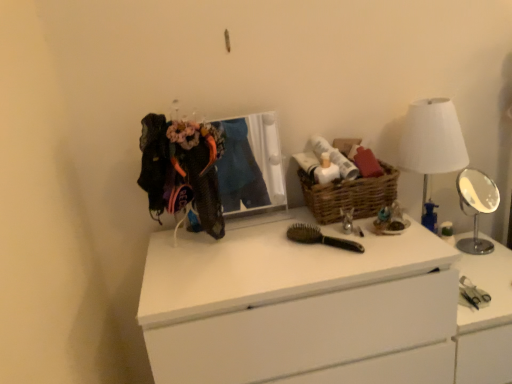
Locate an element on the screen. The height and width of the screenshot is (384, 512). free space between black wooden hairbrush at center and knitted fabric clothesline at upper left is located at coordinates pos(258,245).